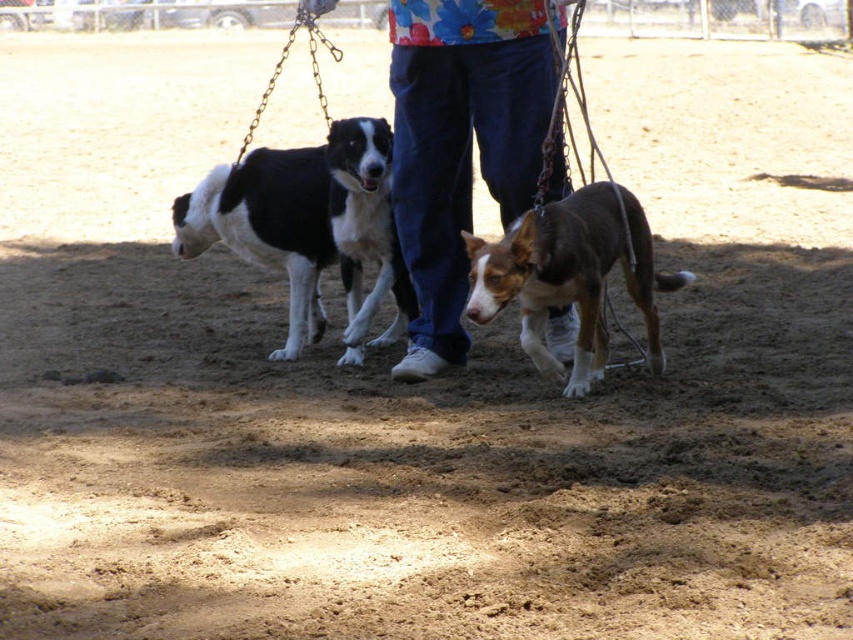
Who is lower down, black and white fur at left or brown/tan fur dog at center?

Positioned lower is brown/tan fur dog at center.

This screenshot has width=853, height=640. What do you see at coordinates (308, 227) in the screenshot?
I see `black and white fur at left` at bounding box center [308, 227].

Is point (380, 128) more distant than point (495, 272)?

Yes, it is behind point (495, 272).

Where is `black and white fur at left`? black and white fur at left is located at coordinates (308, 227).

Who is more distant from viewer, (450, 108) or (347, 186)?

Point (347, 186)

This screenshot has height=640, width=853. I want to click on blue jeans at center, so click(460, 145).

Is point (466, 116) farther from viewer compared to point (575, 237)?

Yes, it is behind point (575, 237).

Which of these two, blue jeans at center or brown/tan fur dog at center, stands taller?

blue jeans at center is taller.

Is point (399, 371) closer to camera compared to point (561, 268)?

No, it is behind (561, 268).

What are the coordinates of `blue jeans at center` in the screenshot? It's located at (460, 145).